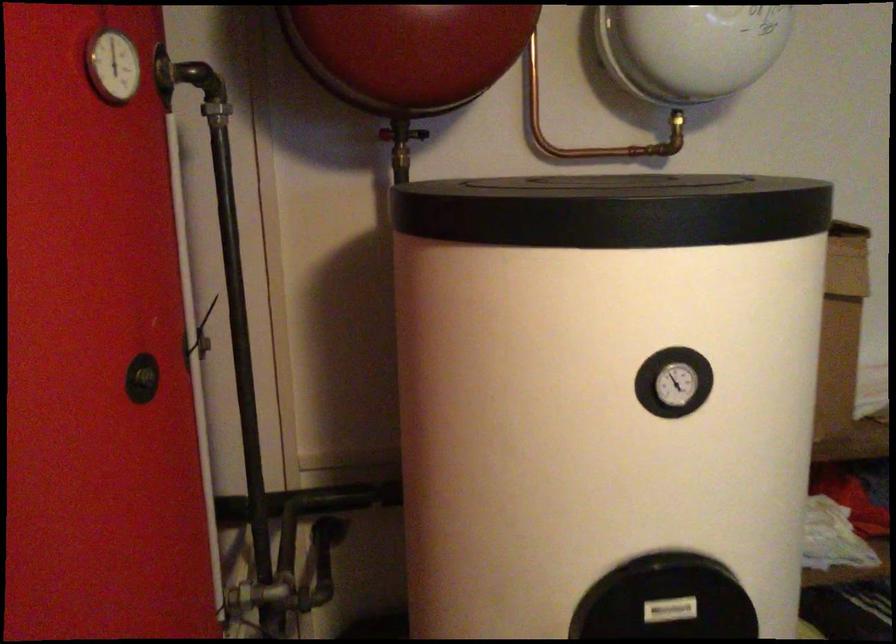
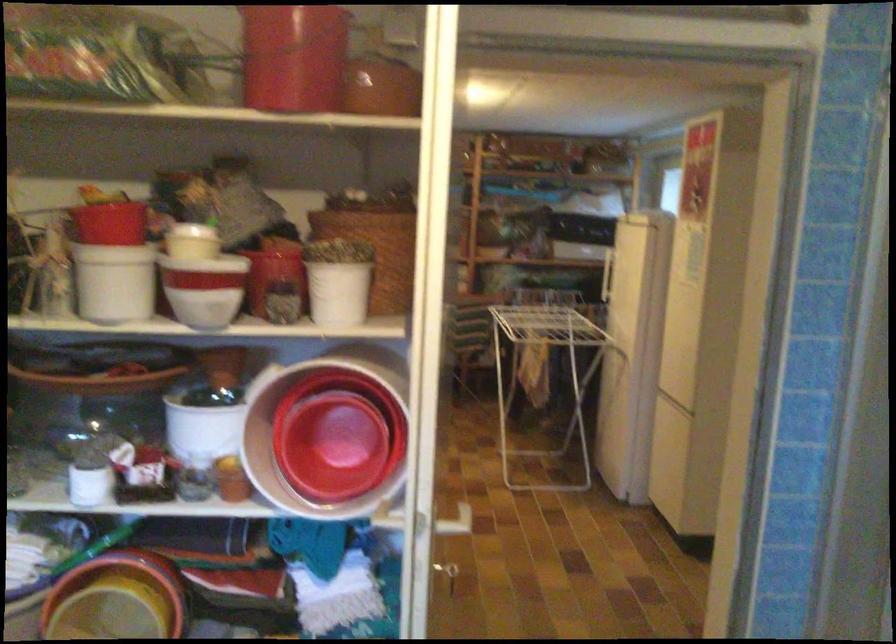
Question: I am providing you with two images of the same scene from different viewpoints. Which of the following objects are not visible in image2?

Choices:
 (A) frosted glass cup
 (B) yellow plastic bucket
 (C) black access cover
 (D) white plastic container

Answer: (C)